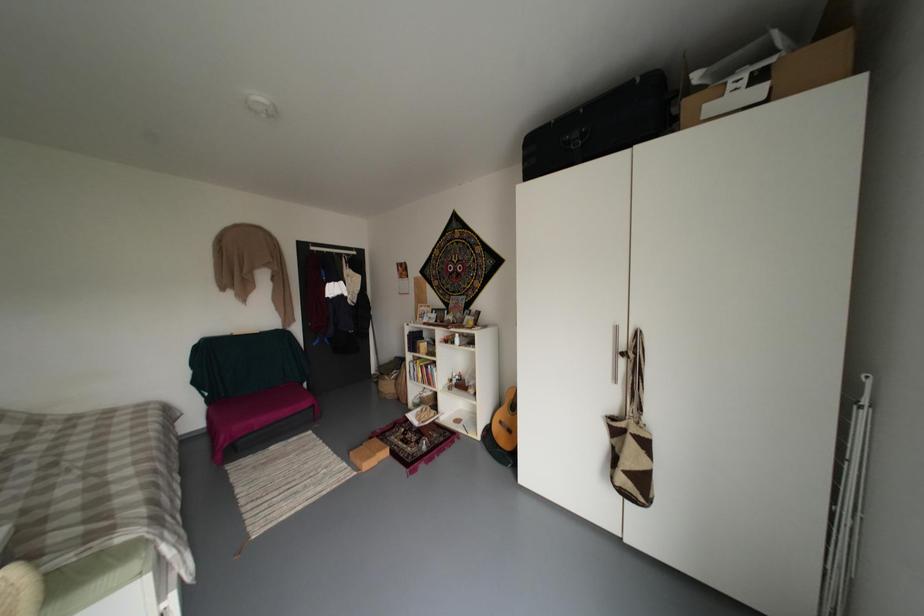
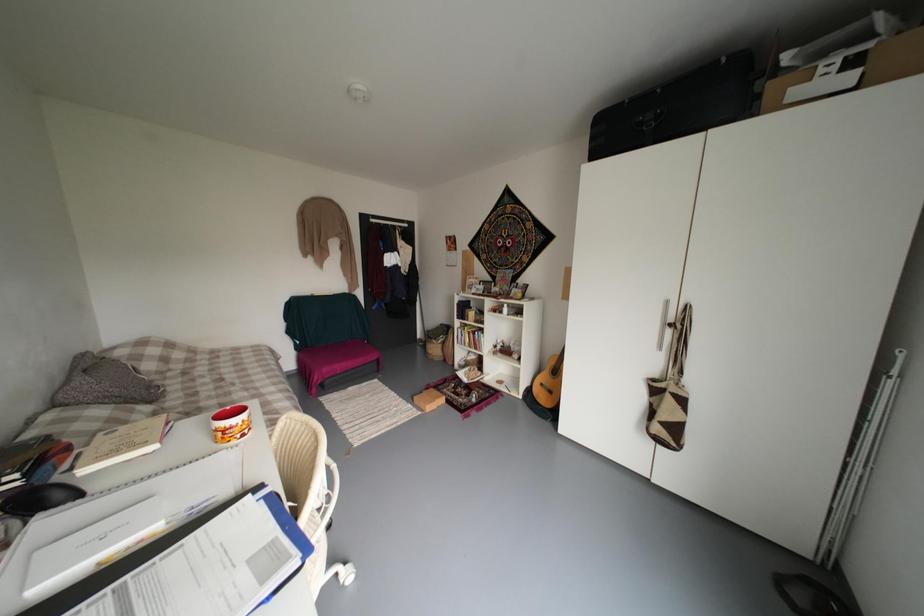
Question: How did the camera likely rotate?

Choices:
 (A) Left
 (B) Right
 (C) Up
 (D) Down

Answer: (D)